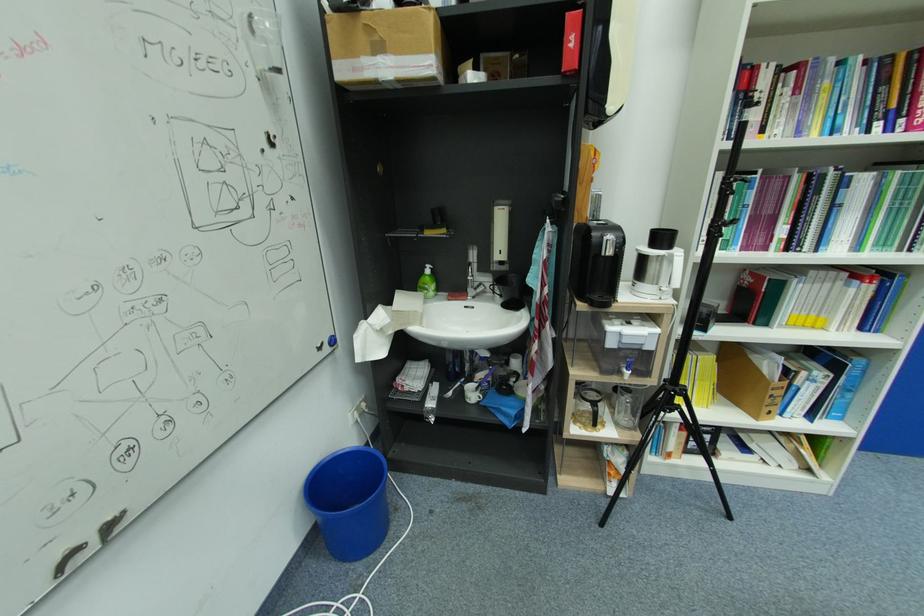
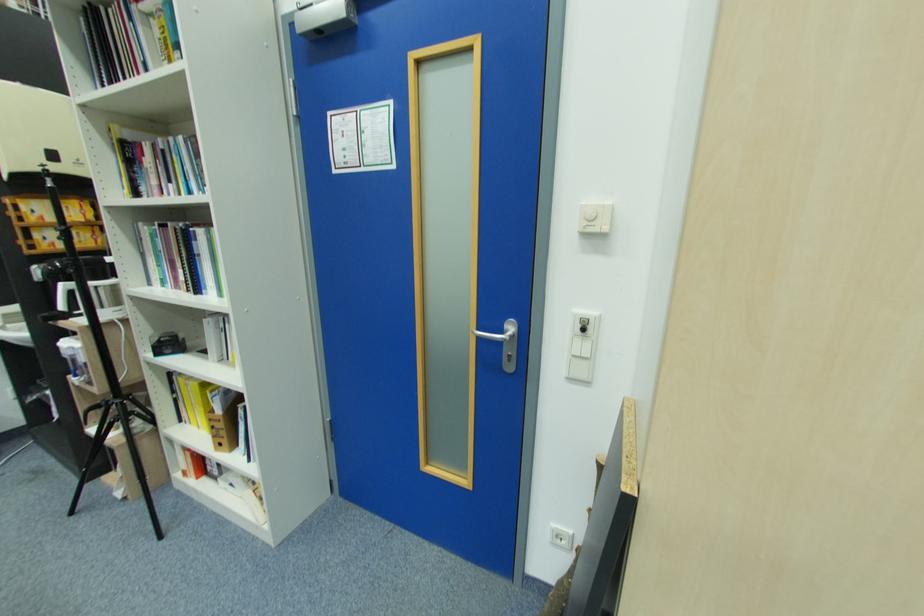
Question: In a continuous first-person perspective shot, in which direction is the camera moving?

Choices:
 (A) Left
 (B) Right
 (C) Forward
 (D) Backward

Answer: (B)